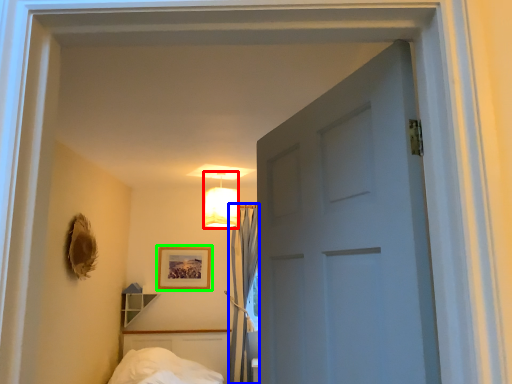
Question: Based on their relative distances, which object is farther from lamp (highlighted by a red box)? Choose from curtain (highlighted by a blue box) and picture frame (highlighted by a green box).

Choices:
 (A) curtain
 (B) picture frame

Answer: (B)